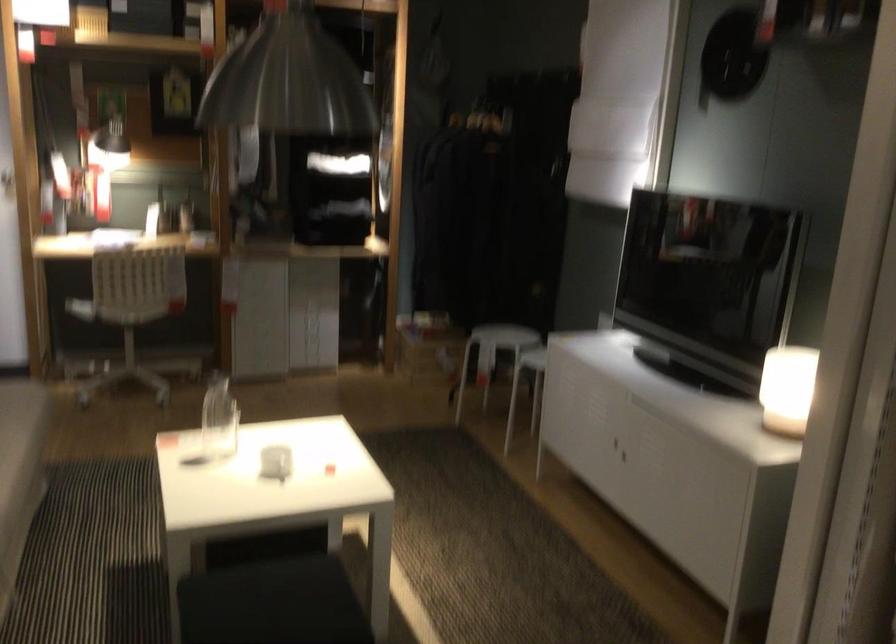
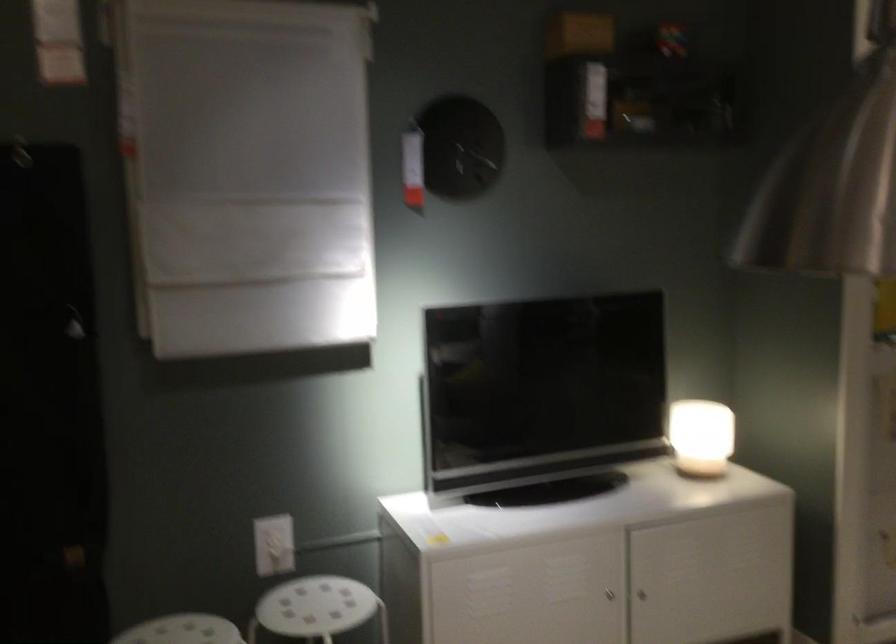
In the second image, find the point that corresponds to (622,449) in the first image.

(641, 594)